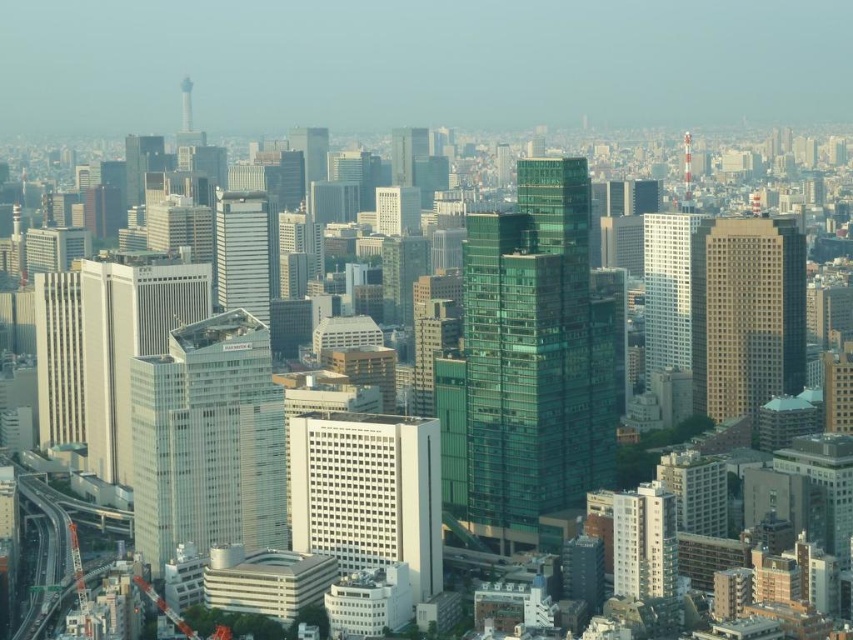
Does point (428, 566) lie behind point (676, 244)?

No, it is in front of (676, 244).

Does white matte building at center have a lesser height compared to white glass building at right?

Yes.

Is point (422, 540) positioned in front of point (650, 308)?

Yes, point (422, 540) is in front of point (650, 308).

At what (x,y) coordinates should I click in order to perform the action: click on white matte building at center. Please return your answer as a coordinate pair (x, y). The width and height of the screenshot is (853, 640). Looking at the image, I should click on (367, 492).

Which of these two, white matte building at center or beige concrete skyscraper at right, stands shorter?

white matte building at center

Does white matte building at center have a lesser height compared to beige concrete skyscraper at right?

Correct, white matte building at center is not as tall as beige concrete skyscraper at right.

Is point (397, 540) in front of point (787, 387)?

Yes.

At what (x,y) coordinates should I click in order to perform the action: click on white matte building at center. Please return your answer as a coordinate pair (x, y). The width and height of the screenshot is (853, 640). Looking at the image, I should click on (x=367, y=492).

Who is shorter, white glass building at right or matte glass skyscraper at center?

With less height is matte glass skyscraper at center.

Locate an element on the screen. Image resolution: width=853 pixels, height=640 pixels. white glass building at right is located at coordinates (666, 289).